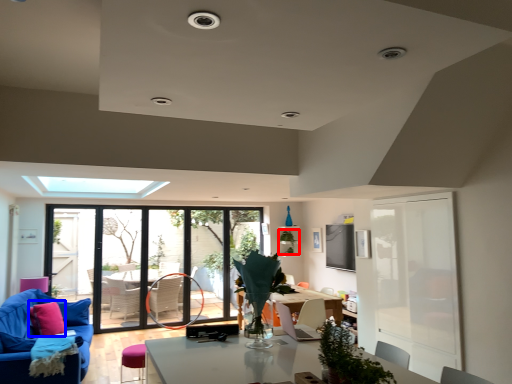
Question: Which of the following is the farthest to the observer, plant (highlighted by a red box) or pillow (highlighted by a blue box)?

Choices:
 (A) plant
 (B) pillow

Answer: (A)